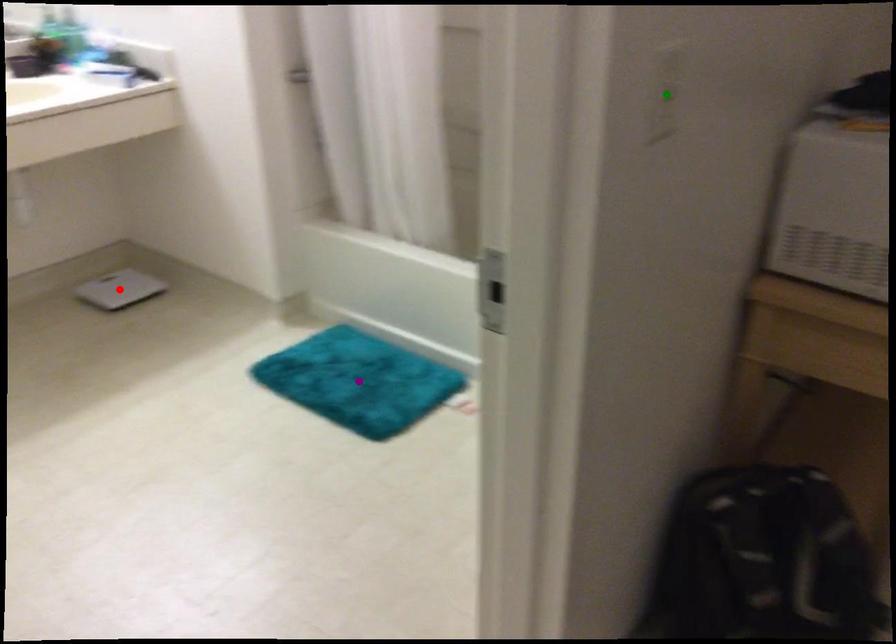
Order these from nearest to farthest:
- green point
- purple point
- red point

red point < purple point < green point